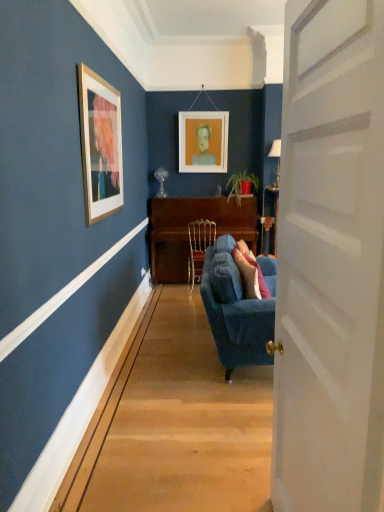
Question: Which direction should I rotate to face matte glass lamp at upper center, which is the first lamp from back to front, — up or down?

Choices:
 (A) down
 (B) up

Answer: (B)

Question: From the image's perspective, is gold metallic chair at center under white wooden door at right?

Choices:
 (A) yes
 (B) no

Answer: (B)

Question: Are gold metallic chair at center and white wooden door at right located far from each other?

Choices:
 (A) no
 (B) yes

Answer: (B)

Question: Is gold metallic chair at center positioned before white wooden door at right?

Choices:
 (A) no
 (B) yes

Answer: (A)

Question: From a real-world perspective, is gold metallic chair at center located beneath white wooden door at right?

Choices:
 (A) yes
 (B) no

Answer: (A)

Question: Considering the relative sizes of gold metallic chair at center and white wooden door at right in the image provided, is gold metallic chair at center shorter than white wooden door at right?

Choices:
 (A) yes
 (B) no

Answer: (A)

Question: Does gold metallic chair at center have a larger size compared to white wooden door at right?

Choices:
 (A) yes
 (B) no

Answer: (B)

Question: Is green matte plant at center taller than white wooden door at right?

Choices:
 (A) no
 (B) yes

Answer: (A)

Question: Is green matte plant at center next to white wooden door at right?

Choices:
 (A) no
 (B) yes

Answer: (A)

Question: Is green matte plant at center turned away from white wooden door at right?

Choices:
 (A) no
 (B) yes

Answer: (A)

Question: From a real-world perspective, does green matte plant at center stand above white wooden door at right?

Choices:
 (A) yes
 (B) no

Answer: (A)

Question: Can you confirm if green matte plant at center is wider than white wooden door at right?

Choices:
 (A) no
 (B) yes

Answer: (B)

Question: Would you say green matte plant at center contains white wooden door at right?

Choices:
 (A) no
 (B) yes

Answer: (A)

Question: Is metallic silver lamp at right, arranged as the 1th lamp when viewed from the front, in contact with green matte plant at center?

Choices:
 (A) no
 (B) yes

Answer: (A)